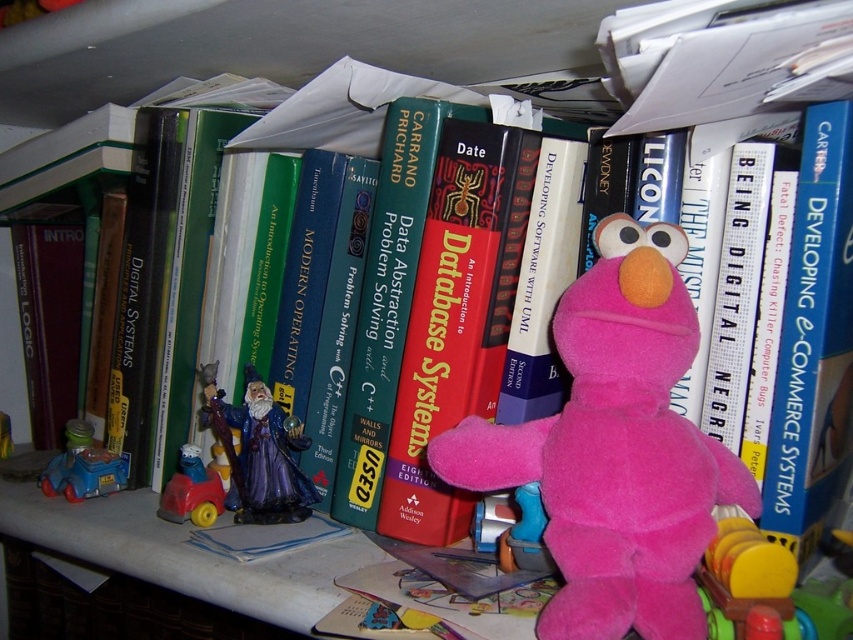
Which of these two, blue plastic car at lower left or plastic toy car at left, stands shorter?

plastic toy car at left is shorter.

Is blue plastic car at lower left bigger than plastic toy car at left?

Correct, blue plastic car at lower left is larger in size than plastic toy car at left.

Where is `blue plastic car at lower left`? This screenshot has height=640, width=853. blue plastic car at lower left is located at coordinates 82,467.

Describe the element at coordinates (614, 449) in the screenshot. The width and height of the screenshot is (853, 640). I see `pink plush at center` at that location.

Who is higher up, pink plush at center or shiny purple wizard figurine at center-left?

Result: pink plush at center

Which is in front, point (572, 470) or point (294, 522)?

Point (572, 470) is in front.

At what (x,y) coordinates should I click in order to perform the action: click on pink plush at center. Please return your answer as a coordinate pair (x, y). Looking at the image, I should click on (614, 449).

Does point (236, 504) come behind point (184, 460)?

Yes, point (236, 504) is farther from viewer.

At what (x,y) coordinates should I click in order to perform the action: click on shiny purple wizard figurine at center-left. Please return your answer as a coordinate pair (x, y). Looking at the image, I should click on (258, 451).

The width and height of the screenshot is (853, 640). I want to click on shiny purple wizard figurine at center-left, so click(x=258, y=451).